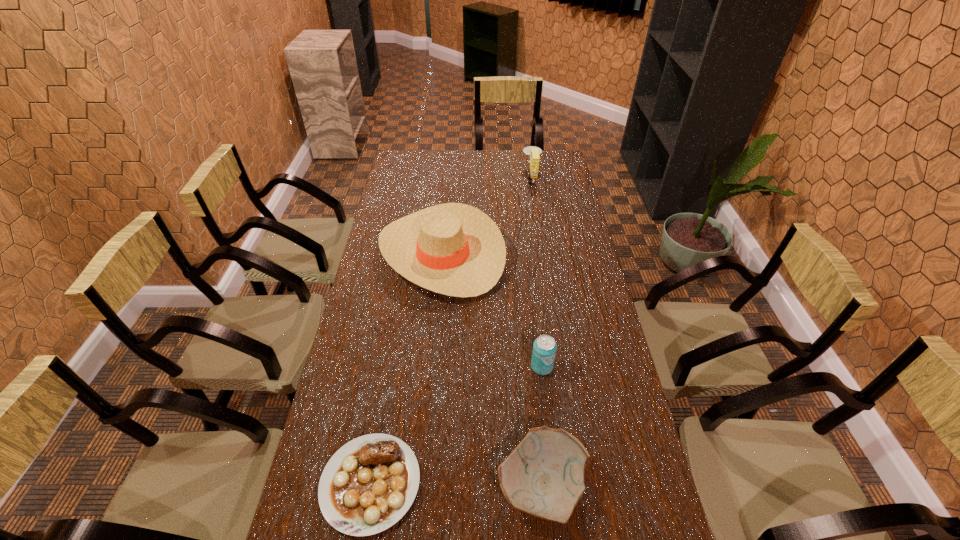
Where is `the farthest object`? This screenshot has height=540, width=960. the farthest object is located at coordinates (533, 151).

Identify the location of the second farthest object. (454, 249).

The width and height of the screenshot is (960, 540). What are the coordinates of `beer can` in the screenshot? It's located at (544, 351).

The image size is (960, 540). What are the coordinates of `the third farthest object` in the screenshot? It's located at (544, 351).

The height and width of the screenshot is (540, 960). I want to click on the fourth tallest object, so click(544, 476).

Identify the location of steak. (368, 485).

This screenshot has height=540, width=960. Identify the location of free space located 0.060m on the front-facing side of the farthest object. point(510,178).

Identify the location of vacant space situated on the front-facing side of the farthest object. The height and width of the screenshot is (540, 960). (484, 178).

Where is `vacant region located 0.130m on the front-facing side of the farthest object`? The image size is (960, 540). vacant region located 0.130m on the front-facing side of the farthest object is located at coordinates (494, 178).

At what (x,y) coordinates should I click in order to perform the action: click on free space located 0.220m on the back of the fourth nearest object. Please return your answer as a coordinate pair (x, y). The width and height of the screenshot is (960, 540). Looking at the image, I should click on (449, 186).